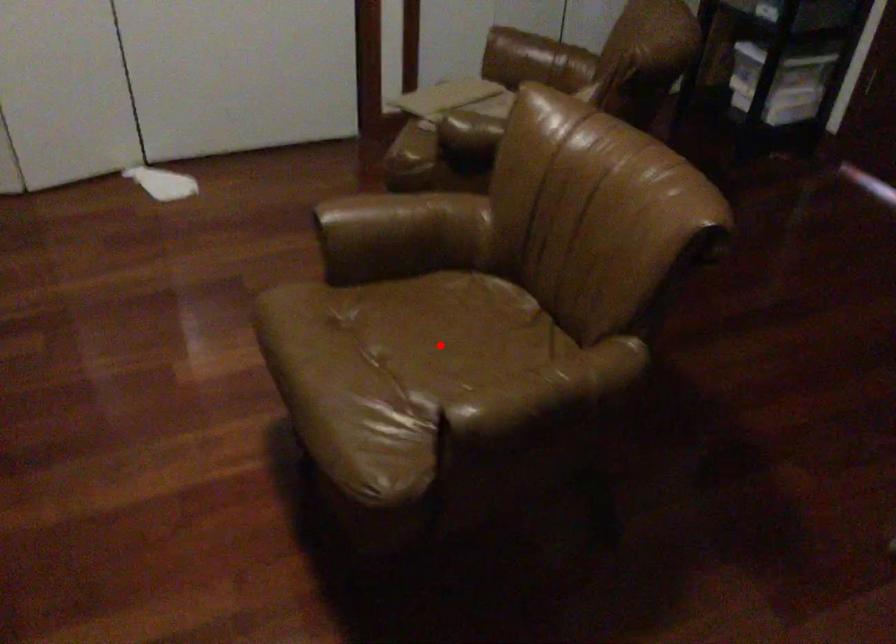
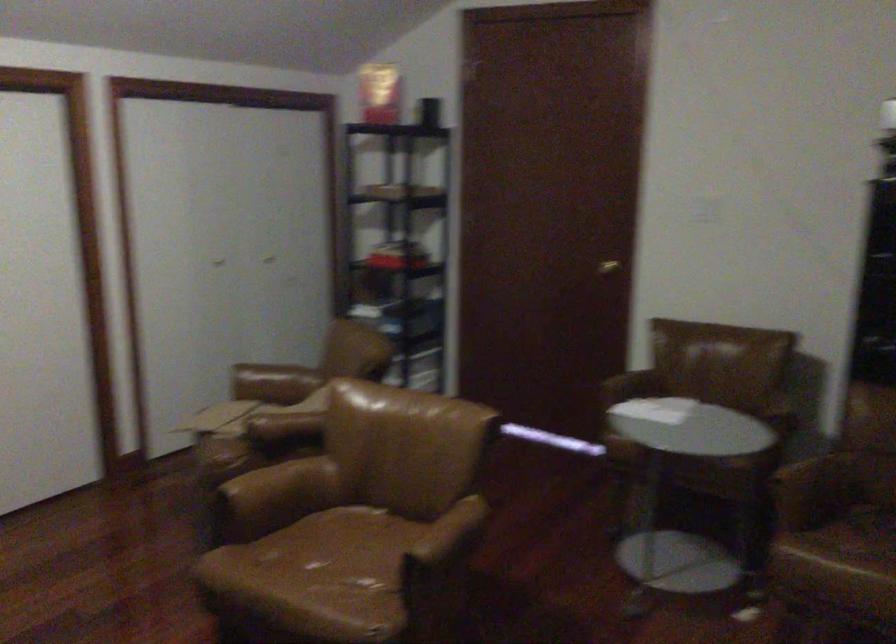
Question: I am providing you with two images of the same scene from different viewpoints. In image1, a red point is highlighted. Considering the same 3D point in image2, which of the following is correct?

Choices:
 (A) It is closer
 (B) It is farther

Answer: (B)